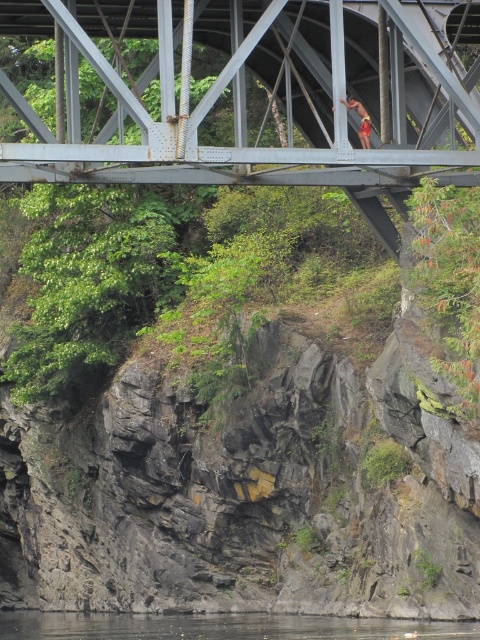
Question: Does metallic gray bridge at center have a smaller size compared to camouflage shorts at center?

Choices:
 (A) yes
 (B) no

Answer: (B)

Question: Which point is farther to the camera?

Choices:
 (A) (346, 104)
 (B) (193, 147)
 (C) (211, 618)

Answer: (C)

Question: Is metallic gray bridge at center further to camera compared to clear water at lower center?

Choices:
 (A) no
 (B) yes

Answer: (A)

Question: Which object is positioned closest to the metallic gray bridge at center?

Choices:
 (A) camouflage shorts at center
 (B) clear water at lower center

Answer: (A)

Question: Observing the image, what is the correct spatial positioning of metallic gray bridge at center in reference to camouflage shorts at center?

Choices:
 (A) above
 (B) below

Answer: (A)

Question: Which point is farther to the camera?

Choices:
 (A) metallic gray bridge at center
 (B) clear water at lower center
 (C) camouflage shorts at center

Answer: (B)